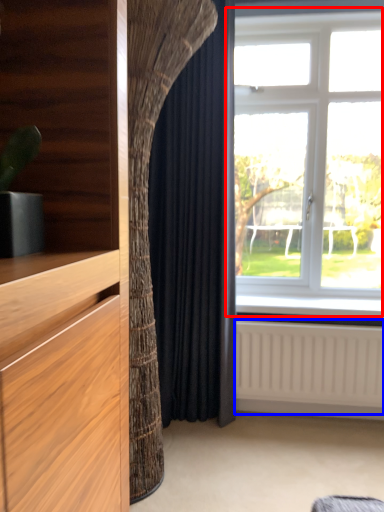
Question: Among these objects, which one is nearest to the camera, window (highlighted by a red box) or radiator (highlighted by a blue box)?

Choices:
 (A) window
 (B) radiator

Answer: (A)